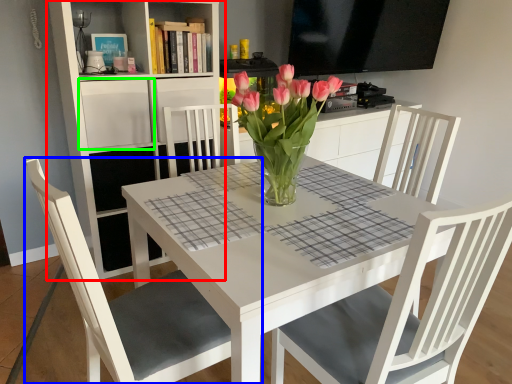
Question: Which object is positioned farthest from shelf (highlighted by a red box)? Select from chair (highlighted by a blue box) and shelf (highlighted by a green box).

Choices:
 (A) chair
 (B) shelf

Answer: (A)